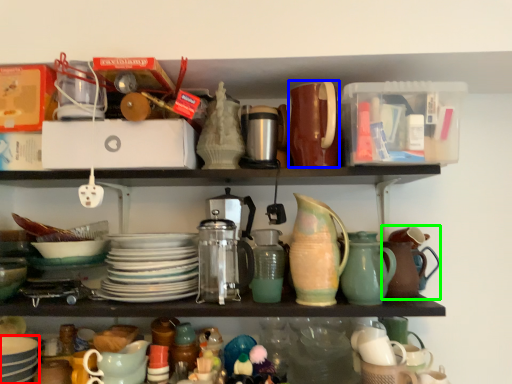
Question: Based on their relative distances, which object is farther from tableware (highlighted by a red box)? Choose from tableware (highlighted by a blue box) and tea pot (highlighted by a green box).

Choices:
 (A) tableware
 (B) tea pot

Answer: (B)